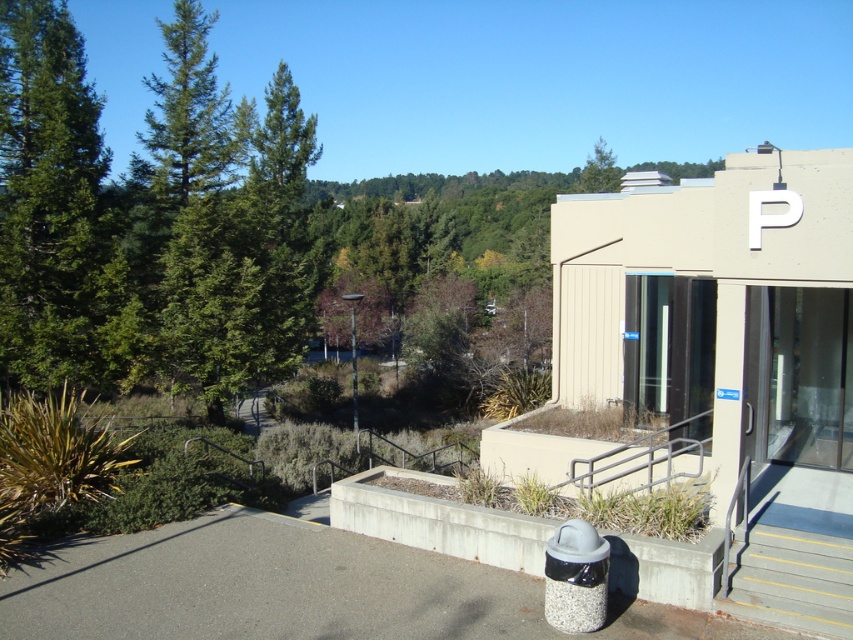
Question: Which object is farther from the camera taking this photo?

Choices:
 (A) green matte tree at left
 (B) gray/steps at lower right

Answer: (A)

Question: Considering the relative positions of green matte tree at left and gray/steps at lower right in the image provided, where is green matte tree at left located with respect to gray/steps at lower right?

Choices:
 (A) below
 (B) above

Answer: (B)

Question: Can you confirm if green matte tree at left is wider than gray/steps at lower right?

Choices:
 (A) no
 (B) yes

Answer: (B)

Question: Which of the following is the closest to the observer?

Choices:
 (A) green matte tree at left
 (B) gray/steps at lower right

Answer: (B)

Question: Can you confirm if green matte tree at left is bigger than gray/steps at lower right?

Choices:
 (A) no
 (B) yes

Answer: (B)

Question: Which of the following is the farthest from the observer?

Choices:
 (A) (48, 230)
 (B) (770, 573)

Answer: (A)